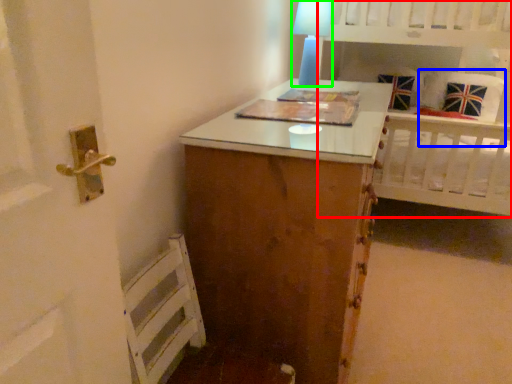
Question: Considering the real-world distances, which object is closest to bed (highlighted by a red box)? pillow (highlighted by a blue box) or table lamp (highlighted by a green box).

Choices:
 (A) pillow
 (B) table lamp

Answer: (A)